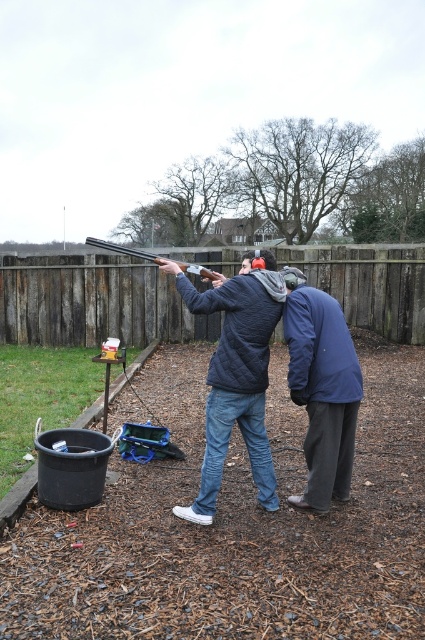
Question: Which point is closer to the camera taking this photo?

Choices:
 (A) (232, 378)
 (B) (212, 273)
 (C) (316, 371)
 (D) (357, 305)

Answer: (A)

Question: Among these objects, which one is nearest to the camera?

Choices:
 (A) matte black shotgun at center
 (B) dark blue fabric jacket at center

Answer: (B)

Question: Can you confirm if brown wooden fence at upper center is wider than matte black shotgun at center?

Choices:
 (A) no
 (B) yes

Answer: (B)

Question: Is dark blue fabric jacket at center to the right of matte black shotgun at center from the viewer's perspective?

Choices:
 (A) yes
 (B) no

Answer: (A)

Question: Does brown wooden fence at upper center appear on the left side of dark blue quilted jacket at center?

Choices:
 (A) yes
 (B) no

Answer: (A)

Question: Which object is closer to the camera taking this photo?

Choices:
 (A) dark blue quilted jacket at center
 (B) brown wooden fence at upper center
 (C) dark blue fabric jacket at center
 (D) matte black shotgun at center

Answer: (A)